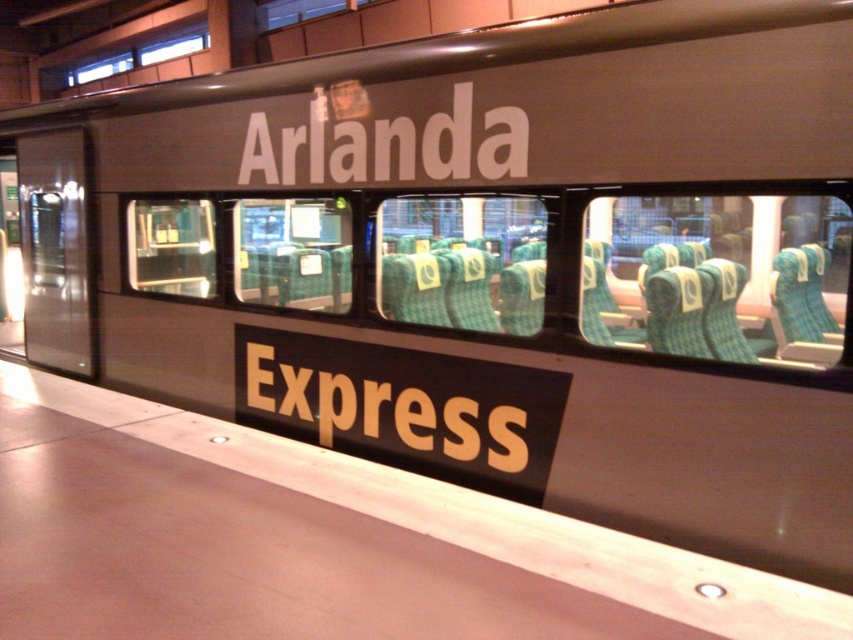
You are a passenger on the Arlanda Express train and need to locate your seat. The train has a yellow matte express at lower center. Where should you look to find your seat number?

The yellow matte express at lower center is located at point (381, 406), so you should look there to find your seat number.

You are a passenger at the Arlanda Express station and want to locate the words displayed on the train. Which object is positioned to the left of the other between the yellow matte express at lower center and the white matte text at center?

The yellow matte express at lower center is positioned to the left of the white matte text at center.

You are a passenger at the Arlanda Express station and need to locate the words displayed on the train. Which object is positioned lower between the yellow matte express at lower center and the white matte text at center?

The yellow matte express at lower center is positioned below the white matte text at center.